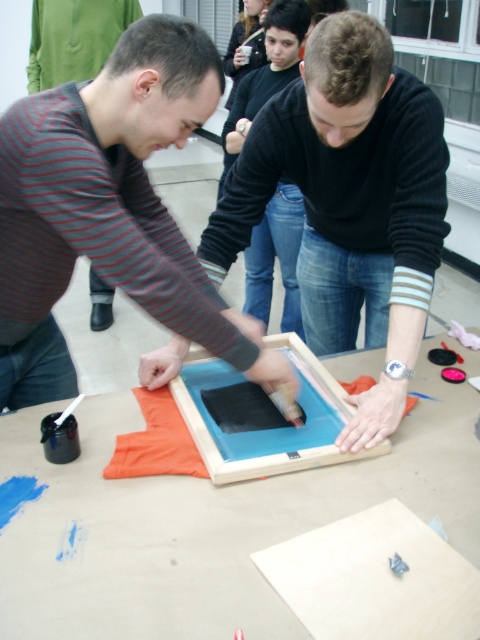
You are a worker in a screen printing workshop. You need to place a 40 cm long tool on the wooden table at center without it overlapping the striped cotton shirt at center. Is this possible?

The wooden table at center is 39.86 centimeters from striped cotton shirt at center. Since the tool is 40 cm long, it might overlap the striped cotton shirt at center if placed directly next to it. Therefore, it is not possible to place the tool without overlapping.

You are standing in the room and want to place a new tool on the wooden table at center. To ensure you place it correctly, which side of the striped cotton shirt at center should you aim for?

The wooden table at center is to the right of striped cotton shirt at center, so you should aim for the right side of the striped cotton shirt at center to place the tool correctly.

You are an observer standing in front of the wooden table at center and the striped cotton shirt at center. Which object is positioned lower from the ground?

The wooden table at center is located below striped cotton shirt at center, so the wooden table at center is positioned lower from the ground.